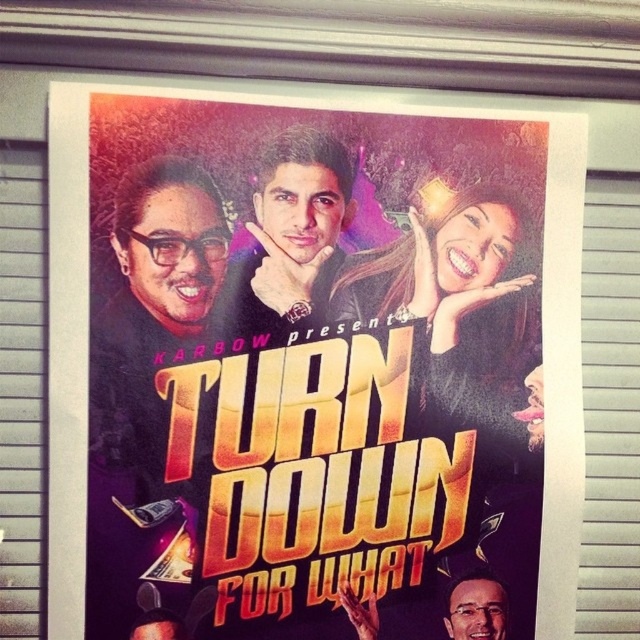
Question: Is vibrant paper poster at center closer to camera compared to smooth skin face at center?

Choices:
 (A) no
 (B) yes

Answer: (B)

Question: Among these objects, which one is farthest from the camera?

Choices:
 (A) black matte hair at upper center
 (B) vibrant paper poster at center

Answer: (A)

Question: Does vibrant paper poster at center have a lesser width compared to smooth skin face at center?

Choices:
 (A) yes
 (B) no

Answer: (B)

Question: Considering the real-world distances, which object is farthest from the smooth skin face at center?

Choices:
 (A) smooth skin face at lower right
 (B) vibrant paper poster at center

Answer: (A)

Question: Based on their relative distances, which object is nearer to the smooth skin face at center?

Choices:
 (A) vibrant paper poster at center
 (B) smooth skin face at lower right
 (C) black matte hair at upper center

Answer: (C)

Question: Does vibrant paper poster at center lie behind smooth skin face at center?

Choices:
 (A) no
 (B) yes

Answer: (A)